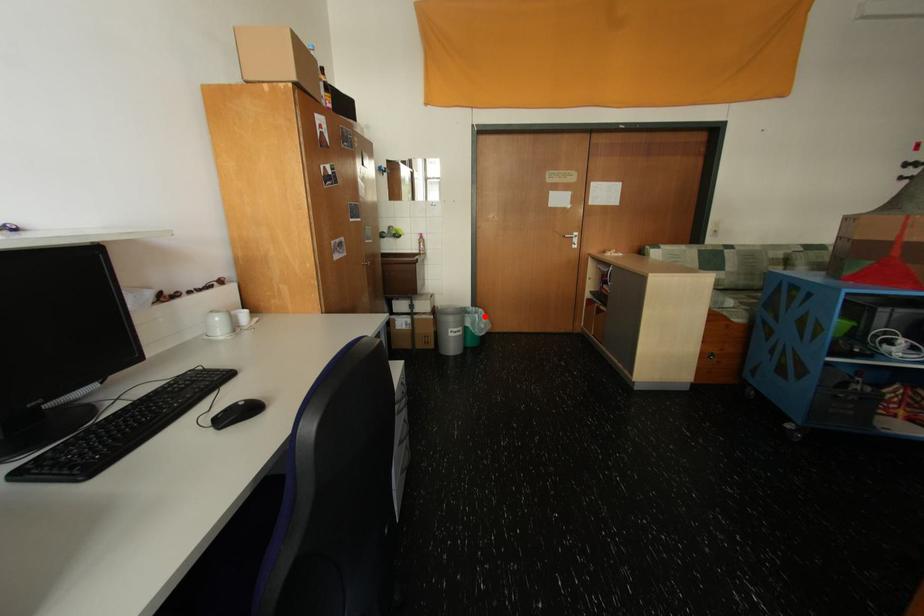
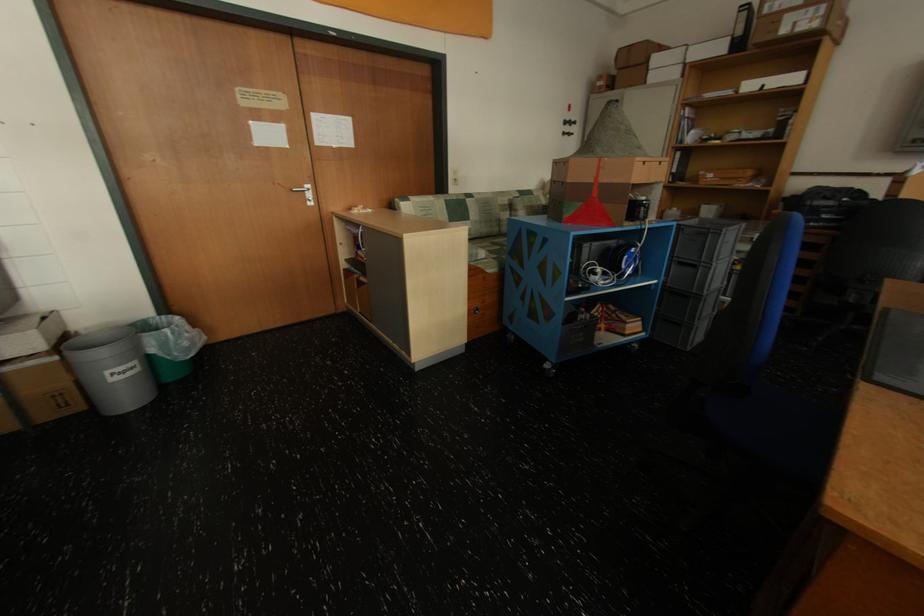
Find the pixel in the second image that matches the highlighted location in the first image.

(176, 331)